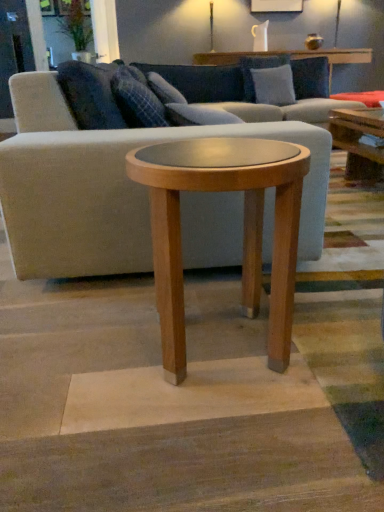
Question: Is light brown wood side table at center taller than light gray fabric couch at center?

Choices:
 (A) no
 (B) yes

Answer: (A)

Question: From the image's perspective, is light brown wood side table at center over light gray fabric couch at center?

Choices:
 (A) no
 (B) yes

Answer: (A)

Question: Can you confirm if light brown wood side table at center is positioned to the left of light gray fabric couch at center?

Choices:
 (A) yes
 (B) no

Answer: (A)

Question: Is light brown wood side table at center completely or partially outside of light gray fabric couch at center?

Choices:
 (A) yes
 (B) no

Answer: (A)

Question: Is light brown wood side table at center oriented towards light gray fabric couch at center?

Choices:
 (A) no
 (B) yes

Answer: (A)

Question: From the image's perspective, is light brown wood side table at center below light gray fabric couch at center?

Choices:
 (A) yes
 (B) no

Answer: (A)

Question: Does light gray fabric couch at center have a larger size compared to plaid fabric pillow at center, which is the 3th pillow from back to front?

Choices:
 (A) yes
 (B) no

Answer: (A)

Question: Considering the relative positions of light gray fabric couch at center and plaid fabric pillow at center, which is the 1th pillow in bottom-to-top order, in the image provided, is light gray fabric couch at center to the right of plaid fabric pillow at center, which is the 1th pillow in bottom-to-top order, from the viewer's perspective?

Choices:
 (A) no
 (B) yes

Answer: (B)

Question: Is light gray fabric couch at center at the left side of plaid fabric pillow at center, the 1th pillow viewed from the left?

Choices:
 (A) yes
 (B) no

Answer: (B)

Question: From a real-world perspective, does light gray fabric couch at center stand above plaid fabric pillow at center, which appears as the third pillow when viewed from the right?

Choices:
 (A) yes
 (B) no

Answer: (B)

Question: Can you confirm if light gray fabric couch at center is wider than plaid fabric pillow at center, which is the 1th pillow in front-to-back order?

Choices:
 (A) no
 (B) yes

Answer: (B)

Question: From the image's perspective, is light gray fabric couch at center located beneath plaid fabric pillow at center, marked as the third pillow in a top-to-bottom arrangement?

Choices:
 (A) no
 (B) yes

Answer: (A)

Question: Considering the relative positions of light gray fabric couch at center and light brown wood side table at center in the image provided, is light gray fabric couch at center to the left of light brown wood side table at center from the viewer's perspective?

Choices:
 (A) yes
 (B) no

Answer: (B)